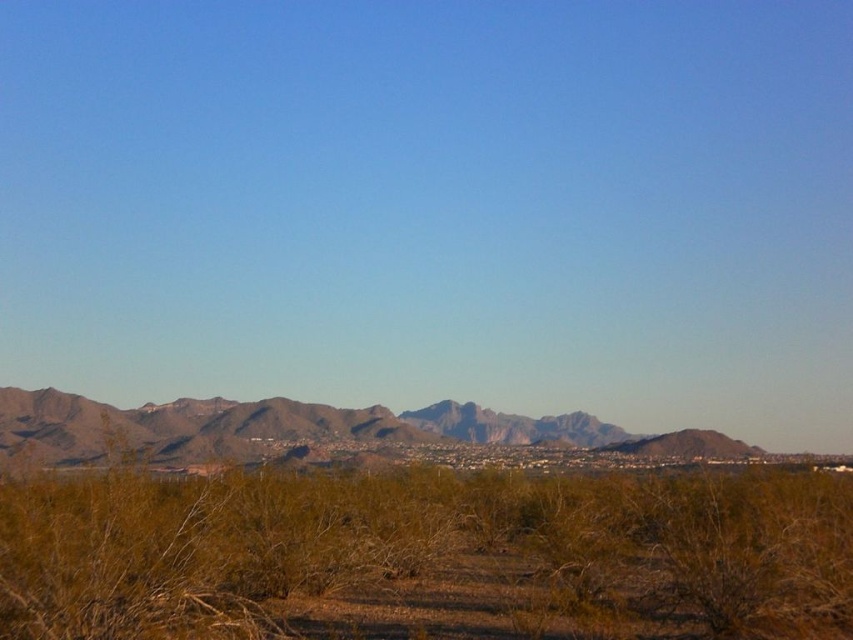
Between point (843, 524) and point (502, 420), which one is positioned in front?

Positioned in front is point (843, 524).

Is point (758, 616) positioned after point (112, 438)?

Yes, point (758, 616) is behind point (112, 438).

You are a GUI agent. You are given a task and a screenshot of the screen. Output one action in this format:
    pyautogui.click(x=<x>, y=<y>)
    Task: Click on the brown shrubbery at center
    
    Given the screenshot: What is the action you would take?
    pyautogui.click(x=428, y=550)